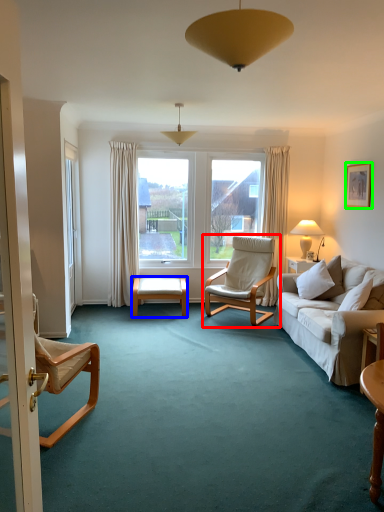
Question: Which object is the closest to the chair (highlighted by a red box)? Choose among these: table (highlighted by a blue box) or picture frame (highlighted by a green box).

Choices:
 (A) table
 (B) picture frame

Answer: (A)